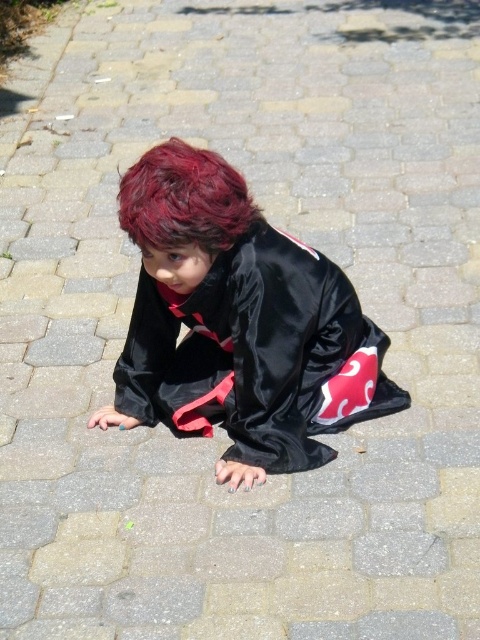
Does satin black kimono at center have a lesser height compared to shiny red hair at center?

No.

Is satin black kimono at center positioned at the back of shiny red hair at center?

Yes, it is.

Locate an element on the screen. satin black kimono at center is located at coordinates (238, 323).

At what (x,y) coordinates should I click in order to perform the action: click on satin black kimono at center. Please return your answer as a coordinate pair (x, y). Looking at the image, I should click on (238, 323).